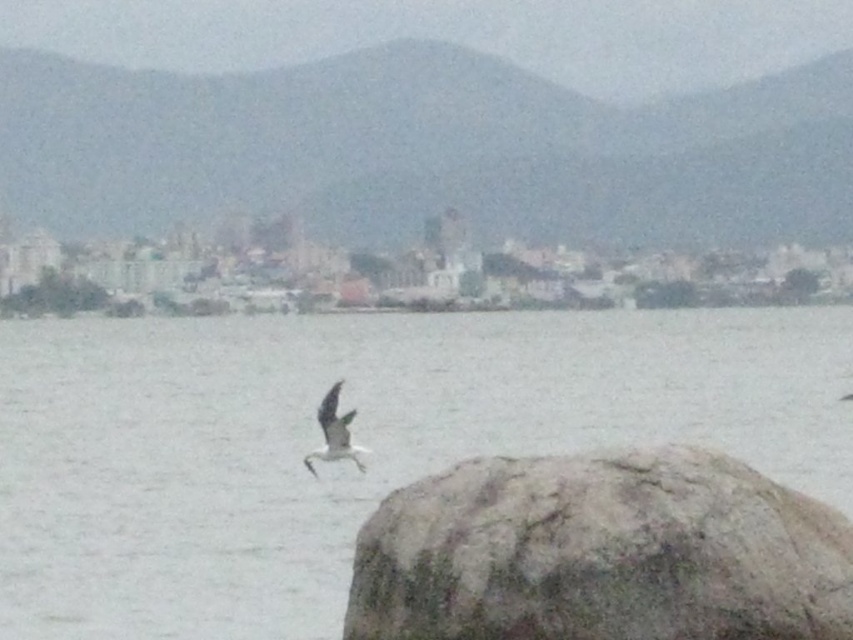
You are a photographer trying to capture the white feathered bird at center and the gray matte water at center in a single shot. Based on their positions, which one will appear larger in the photo?

The gray matte water at center appears larger in the photo because it is much taller than the white feathered bird at center.

You are a photographer trying to capture the white feathered bird at center and the gray rough rock at lower right in the same frame. Based on their sizes in the image, which object would appear larger in your photo?

The gray rough rock at lower right appears larger in the photo because it is much taller than the white feathered bird at center.

You are a photographer trying to capture the reflection of the city in the water. You are standing near the gray rough rock at lower right. Which direction should you move to ensure you can see the city reflection in the gray matte water at center?

You should move to the left side of the gray rough rock at lower right because the gray matte water at center is positioned on the left side of the gray rough rock at lower right, allowing you to see the city reflection in it.